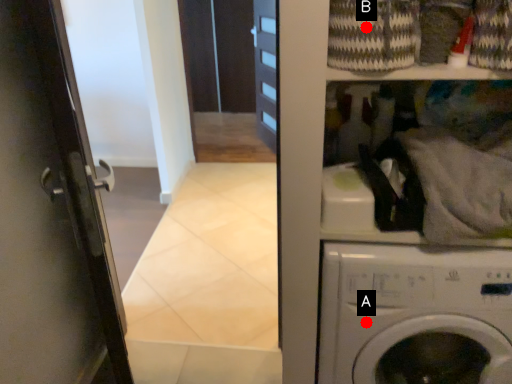
Question: Two points are circled on the image, labeled by A and B beside each circle. Which point is further to the camera?

Choices:
 (A) A is further
 (B) B is further

Answer: (A)